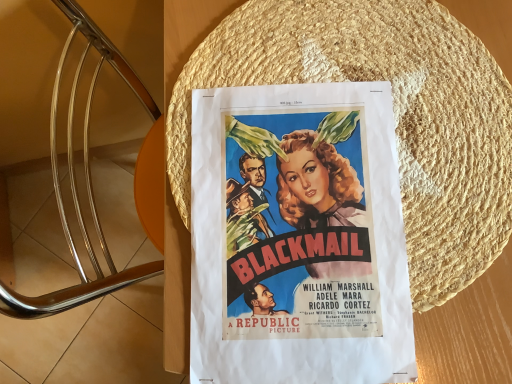
Identify the location of vacant point to the right of matte paper poster at center. (457, 204).